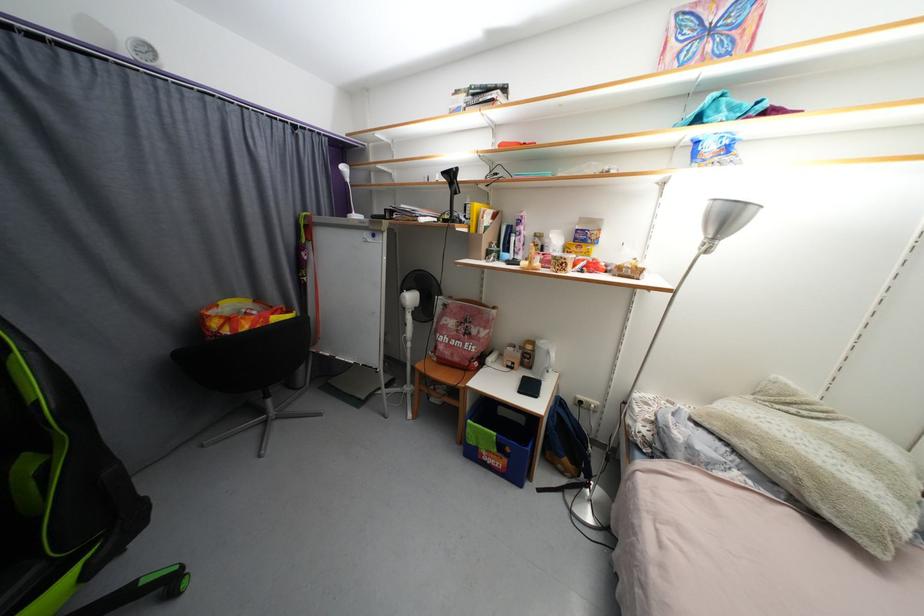
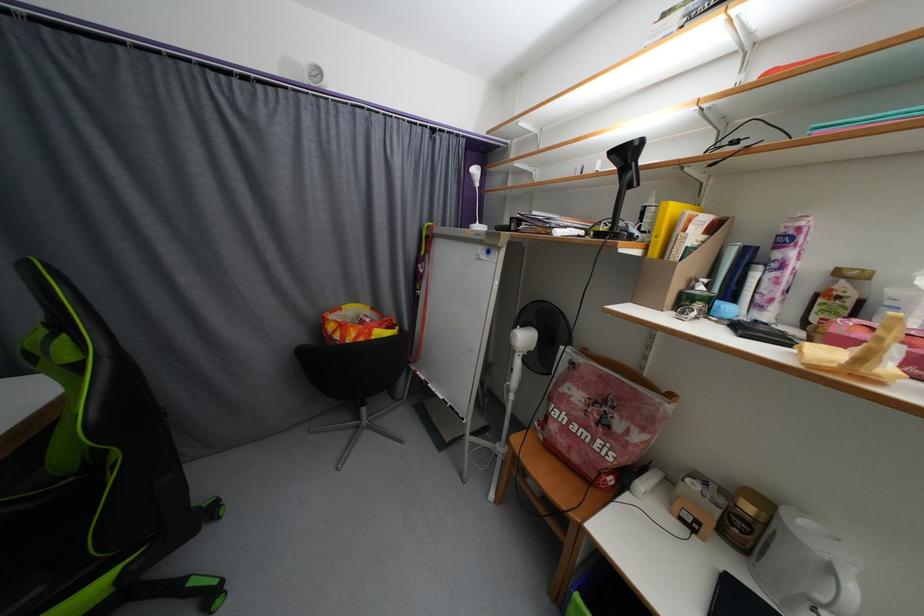
Question: The images are taken continuously from a first-person perspective. In which direction is your viewpoint rotating?

Choices:
 (A) Left
 (B) Right
 (C) Up
 (D) Down

Answer: (A)